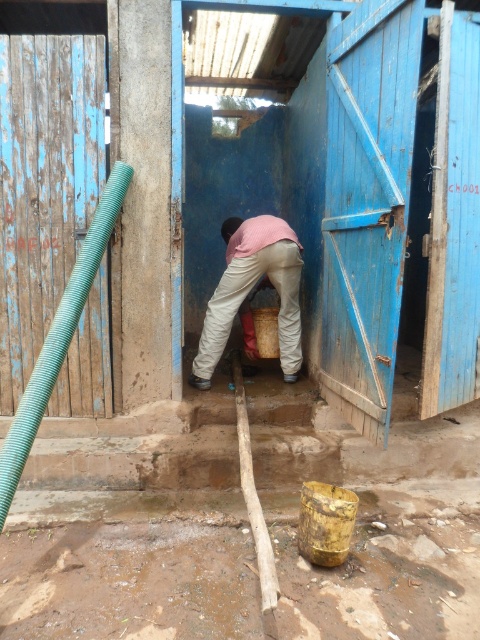
You are a photographer standing at the camera position. You want to capture a closeup of the brown clay mud at lower center. Can you move closer to the mud without stepping on it?

The brown clay mud at lower center and camera are 8.12 feet apart. Since you can move closer, you can step forward to get nearer to the brown clay mud at lower center while avoiding stepping on it by adjusting your position.

You are a construction worker inspecting the latrine. You notice the brown clay mud at lower center and the pink fabric at center. Which object is lower in height?

The brown clay mud at lower center is shorter than the pink fabric at center, so the brown clay mud at lower center is lower in height.